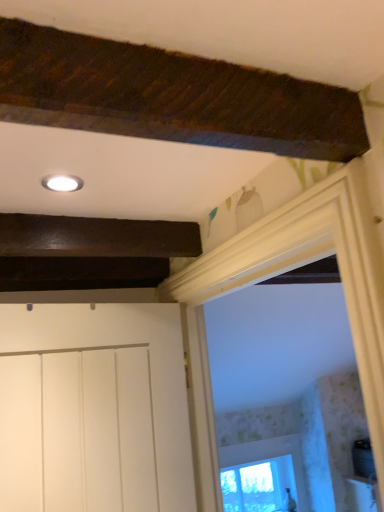
I want to click on transparent glass window at center, so click(x=263, y=475).

What do you see at coordinates (263, 475) in the screenshot? This screenshot has height=512, width=384. I see `transparent glass window at center` at bounding box center [263, 475].

I want to click on transparent glass window at center, so click(263, 475).